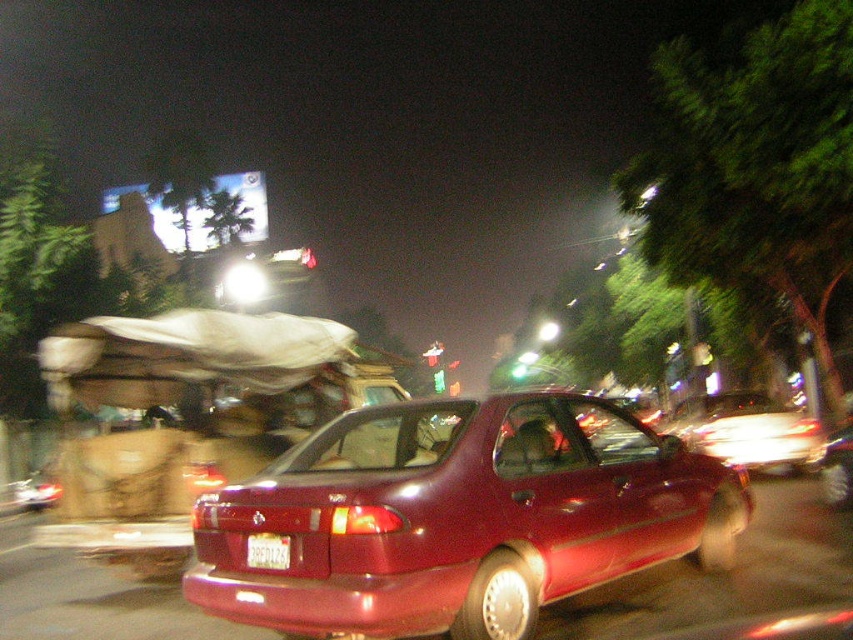
Can you confirm if matte red car at center is shorter than white plastic license plate at rear?

No.

Looking at this image, who is more distant from viewer, [641,522] or [252,547]?

The point [641,522] is more distant.

Find the location of a particular element. matte red car at center is located at coordinates (461, 516).